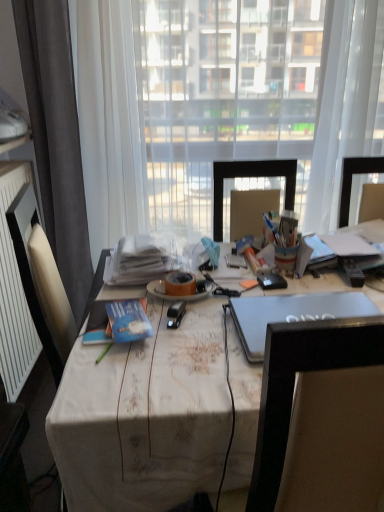
Find the location of a particular element. vacant area in front of translucent orange adhesive tape at center is located at coordinates (195, 325).